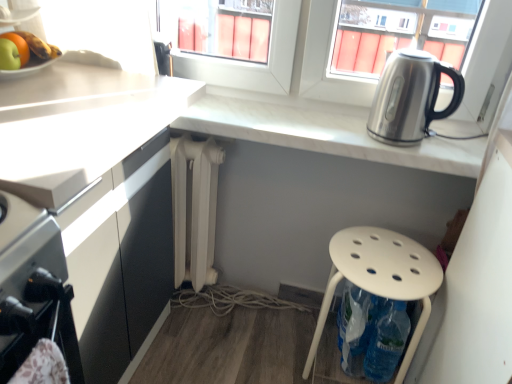
The width and height of the screenshot is (512, 384). Find the location of `spots to the right of stainless steel kettle at upper right`. spots to the right of stainless steel kettle at upper right is located at coordinates (460, 139).